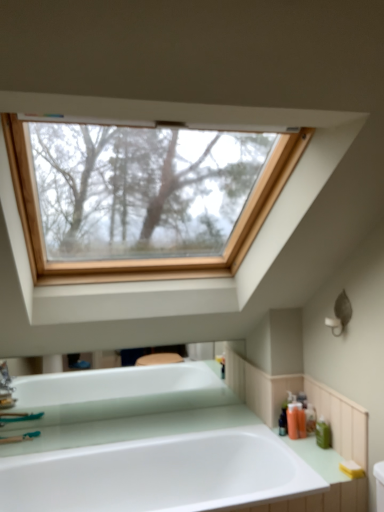
Find the location of a particular element. This screenshot has width=384, height=512. translucent plastic soap dispenser at right, placed as the second toiletry when sorted from back to front is located at coordinates (301, 420).

The width and height of the screenshot is (384, 512). What do you see at coordinates (144, 445) in the screenshot?
I see `white glossy bathtub at center` at bounding box center [144, 445].

This screenshot has width=384, height=512. In order to click on green matte bottle at right, the first toiletry in the front-to-back sequence in this screenshot , I will do `click(323, 433)`.

Find the location of `translucent plastic soap dispenser at right, placed as the second toiletry when sorted from back to front`. translucent plastic soap dispenser at right, placed as the second toiletry when sorted from back to front is located at coordinates (301, 420).

Can you confirm if orange matte bottle at lower right, which is the 2th toiletry from front to back, is wider than yellow sponge at lower right?

Incorrect, the width of orange matte bottle at lower right, which is the 2th toiletry from front to back, does not surpass that of yellow sponge at lower right.

Considering the positions of objects orange matte bottle at lower right, which is the 2th toiletry from front to back, and yellow sponge at lower right in the image provided, who is more to the right, orange matte bottle at lower right, which is the 2th toiletry from front to back, or yellow sponge at lower right?

yellow sponge at lower right.

What's the angular difference between orange matte bottle at lower right, which is the third toiletry in back-to-front order, and yellow sponge at lower right's facing directions?

The angular difference between orange matte bottle at lower right, which is the third toiletry in back-to-front order, and yellow sponge at lower right is 2.39 degrees.

Is orange matte bottle at lower right, which is the third toiletry in back-to-front order, in front of yellow sponge at lower right?

That is False.

From a real-world perspective, count 1st toiletrys downward from the orange matte bottle at lower right, which is the 2th toiletry from front to back, and point to it. Please provide its 2D coordinates.

[(301, 420)]

From a real-world perspective, is translucent plastic soap dispenser at right, marked as the 3th toiletry in a front-to-back arrangement, positioned above or below orange matte bottle at lower right, which is the 2th toiletry from front to back?

Clearly, from a real-world perspective, translucent plastic soap dispenser at right, marked as the 3th toiletry in a front-to-back arrangement, is below orange matte bottle at lower right, which is the 2th toiletry from front to back.

Which is correct: translucent plastic soap dispenser at right, placed as the second toiletry when sorted from back to front, is inside orange matte bottle at lower right, which is the third toiletry in back-to-front order, or outside of it?

translucent plastic soap dispenser at right, placed as the second toiletry when sorted from back to front, is not inside orange matte bottle at lower right, which is the third toiletry in back-to-front order, it's outside.

From a real-world perspective, is yellow sponge at lower right physically below translucent plastic soap dispenser at right, which is counted as the 1th toiletry, starting from the back?

Yes.

Between yellow sponge at lower right and translucent plastic soap dispenser at right, placed as the 4th toiletry when sorted from front to back, which one has less height?

yellow sponge at lower right is shorter.

Between yellow sponge at lower right and translucent plastic soap dispenser at right, placed as the 4th toiletry when sorted from front to back, which one has smaller width?

translucent plastic soap dispenser at right, placed as the 4th toiletry when sorted from front to back.

Is yellow sponge at lower right bigger or smaller than translucent plastic soap dispenser at right, which is counted as the 1th toiletry, starting from the back?

Clearly, yellow sponge at lower right is smaller in size than translucent plastic soap dispenser at right, which is counted as the 1th toiletry, starting from the back.

Relative to translucent plastic soap dispenser at right, placed as the 4th toiletry when sorted from front to back, is green matte bottle at right, the first toiletry in the front-to-back sequence, in front or behind?

Clearly, green matte bottle at right, the first toiletry in the front-to-back sequence, is in front of translucent plastic soap dispenser at right, placed as the 4th toiletry when sorted from front to back.

Based on the photo, considering the relative sizes of green matte bottle at right, the first toiletry in the front-to-back sequence, and translucent plastic soap dispenser at right, placed as the 4th toiletry when sorted from front to back, in the image provided, is green matte bottle at right, the first toiletry in the front-to-back sequence, taller than translucent plastic soap dispenser at right, placed as the 4th toiletry when sorted from front to back,?

No, green matte bottle at right, the first toiletry in the front-to-back sequence, is not taller than translucent plastic soap dispenser at right, placed as the 4th toiletry when sorted from front to back.

Considering the sizes of objects green matte bottle at right, the first toiletry in the front-to-back sequence, and translucent plastic soap dispenser at right, placed as the 4th toiletry when sorted from front to back, in the image provided, who is thinner, green matte bottle at right, the first toiletry in the front-to-back sequence, or translucent plastic soap dispenser at right, placed as the 4th toiletry when sorted from front to back,?

translucent plastic soap dispenser at right, placed as the 4th toiletry when sorted from front to back.

From a real-world perspective, is green matte bottle at right, the first toiletry in the front-to-back sequence, located beneath translucent plastic soap dispenser at right, placed as the 4th toiletry when sorted from front to back?

Yes, from a real-world perspective, green matte bottle at right, the first toiletry in the front-to-back sequence, is below translucent plastic soap dispenser at right, placed as the 4th toiletry when sorted from front to back.

From a real-world perspective, is white glossy bathtub at center physically above translucent plastic soap dispenser at right, marked as the 3th toiletry in a front-to-back arrangement?

Incorrect, from a real-world perspective, white glossy bathtub at center is lower than translucent plastic soap dispenser at right, marked as the 3th toiletry in a front-to-back arrangement.

Does point (142, 506) lie behind point (300, 404)?

No, (142, 506) is closer to viewer.

Does white glossy bathtub at center turn towards translucent plastic soap dispenser at right, marked as the 3th toiletry in a front-to-back arrangement?

No, white glossy bathtub at center does not turn towards translucent plastic soap dispenser at right, marked as the 3th toiletry in a front-to-back arrangement.

Can we say white glossy bathtub at center lies outside translucent plastic soap dispenser at right, placed as the second toiletry when sorted from back to front?

white glossy bathtub at center is positioned outside translucent plastic soap dispenser at right, placed as the second toiletry when sorted from back to front.

Is translucent plastic soap dispenser at right, placed as the 4th toiletry when sorted from front to back, next to orange matte bottle at lower right, which is the third toiletry in back-to-front order, and touching it?

Yes, translucent plastic soap dispenser at right, placed as the 4th toiletry when sorted from front to back, and orange matte bottle at lower right, which is the third toiletry in back-to-front order, clearly make contact.

Can you confirm if translucent plastic soap dispenser at right, which is counted as the 1th toiletry, starting from the back, is wider than orange matte bottle at lower right, which is the third toiletry in back-to-front order?

In fact, translucent plastic soap dispenser at right, which is counted as the 1th toiletry, starting from the back, might be narrower than orange matte bottle at lower right, which is the third toiletry in back-to-front order.

Is translucent plastic soap dispenser at right, placed as the 4th toiletry when sorted from front to back, further to camera compared to orange matte bottle at lower right, which is the 2th toiletry from front to back?

Yes, translucent plastic soap dispenser at right, placed as the 4th toiletry when sorted from front to back, is further from the viewer.

How many degrees apart are the facing directions of translucent plastic soap dispenser at right, placed as the 4th toiletry when sorted from front to back, and orange matte bottle at lower right, which is the 2th toiletry from front to back?

There is a 0.0046-degree angle between the facing directions of translucent plastic soap dispenser at right, placed as the 4th toiletry when sorted from front to back, and orange matte bottle at lower right, which is the 2th toiletry from front to back.

Where is `bathtub below the translucent plastic soap dispenser at right, which is counted as the 1th toiletry, starting from the back (from a real-world perspective)`? This screenshot has width=384, height=512. bathtub below the translucent plastic soap dispenser at right, which is counted as the 1th toiletry, starting from the back (from a real-world perspective) is located at coordinates (144, 445).

Is point (306, 429) closer to viewer compared to point (156, 473)?

Yes, point (306, 429) is in front of point (156, 473).

In the image, is translucent plastic soap dispenser at right, placed as the 4th toiletry when sorted from front to back, positioned in front of or behind white glossy bathtub at center?

Visually, translucent plastic soap dispenser at right, placed as the 4th toiletry when sorted from front to back, is located behind white glossy bathtub at center.

Is white glossy bathtub at center at the back of translucent plastic soap dispenser at right, placed as the 4th toiletry when sorted from front to back?

translucent plastic soap dispenser at right, placed as the 4th toiletry when sorted from front to back, does not have its back to white glossy bathtub at center.

There is a yellow sponge at lower right. Where is `the 3rd toiletry above it (from a real-world perspective)`? The width and height of the screenshot is (384, 512). the 3rd toiletry above it (from a real-world perspective) is located at coordinates (293, 418).

Starting from the orange matte bottle at lower right, which is the third toiletry in back-to-front order, which toiletry is the 1st one behind? Please provide its 2D coordinates.

[(301, 420)]

Which object lies nearer to the anchor point yellow sponge at lower right, white glossy bathtub at center or translucent plastic soap dispenser at right, placed as the 4th toiletry when sorted from front to back?

Based on the image, translucent plastic soap dispenser at right, placed as the 4th toiletry when sorted from front to back, appears to be nearer to yellow sponge at lower right.

Considering their positions, is yellow sponge at lower right positioned closer to orange matte bottle at lower right, which is the third toiletry in back-to-front order, than white glossy bathtub at center?

yellow sponge at lower right.

Looking at the image, which one is located further to white glossy bathtub at center, orange matte bottle at lower right, which is the 2th toiletry from front to back, or translucent plastic soap dispenser at right, placed as the second toiletry when sorted from back to front?

Among the two, translucent plastic soap dispenser at right, placed as the second toiletry when sorted from back to front, is located further to white glossy bathtub at center.

Considering their positions, is green matte bottle at right, the 4th toiletry in the back-to-front sequence, positioned closer to orange matte bottle at lower right, which is the third toiletry in back-to-front order, than white glossy bathtub at center?

green matte bottle at right, the 4th toiletry in the back-to-front sequence, is closer to orange matte bottle at lower right, which is the third toiletry in back-to-front order.

Looking at this image, looking at the image, which one is located further to green matte bottle at right, the 4th toiletry in the back-to-front sequence, translucent plastic soap dispenser at right, placed as the second toiletry when sorted from back to front, or translucent plastic soap dispenser at right, which is counted as the 1th toiletry, starting from the back?

The object further to green matte bottle at right, the 4th toiletry in the back-to-front sequence, is translucent plastic soap dispenser at right, placed as the second toiletry when sorted from back to front.

From the image, which object appears to be nearer to translucent plastic soap dispenser at right, placed as the second toiletry when sorted from back to front, yellow sponge at lower right or orange matte bottle at lower right, which is the third toiletry in back-to-front order?

orange matte bottle at lower right, which is the third toiletry in back-to-front order, is positioned closer to the anchor translucent plastic soap dispenser at right, placed as the second toiletry when sorted from back to front.

Based on their spatial positions, is orange matte bottle at lower right, which is the 2th toiletry from front to back, or green matte bottle at right, the first toiletry in the front-to-back sequence, further from translucent plastic soap dispenser at right, placed as the 4th toiletry when sorted from front to back?

orange matte bottle at lower right, which is the 2th toiletry from front to back.

Estimate the real-world distances between objects in this image. Which object is closer to orange matte bottle at lower right, which is the third toiletry in back-to-front order, white glossy bathtub at center or green matte bottle at right, the 4th toiletry in the back-to-front sequence?

green matte bottle at right, the 4th toiletry in the back-to-front sequence.

The height and width of the screenshot is (512, 384). What are the coordinates of `toiletry between green matte bottle at right, the 4th toiletry in the back-to-front sequence, and translucent plastic soap dispenser at right, marked as the 3th toiletry in a front-to-back arrangement, from front to back` in the screenshot? It's located at [293, 418].

The image size is (384, 512). I want to click on toiletry situated between orange matte bottle at lower right, which is the 2th toiletry from front to back, and translucent plastic soap dispenser at right, which is counted as the 1th toiletry, starting from the back, from left to right, so click(301, 420).

Where is `toiletry between yellow sponge at lower right and orange matte bottle at lower right, which is the third toiletry in back-to-front order, in the front-back direction`? toiletry between yellow sponge at lower right and orange matte bottle at lower right, which is the third toiletry in back-to-front order, in the front-back direction is located at coordinates (323, 433).

Image resolution: width=384 pixels, height=512 pixels. I want to click on toiletry between white glossy bathtub at center and orange matte bottle at lower right, which is the third toiletry in back-to-front order, along the z-axis, so [x=323, y=433].